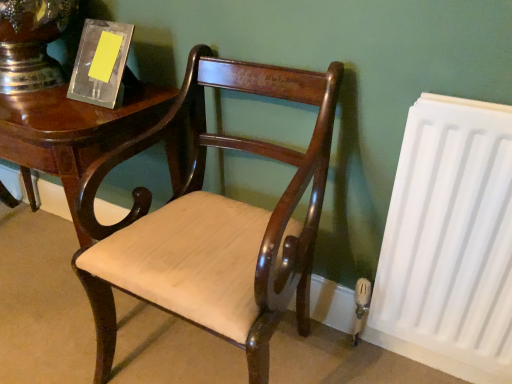
Question: Is white matte radiator at right completely or partially inside shiny dark wood table at left?

Choices:
 (A) yes
 (B) no

Answer: (B)

Question: Considering the relative sizes of shiny dark wood table at left and white matte radiator at right in the image provided, is shiny dark wood table at left bigger than white matte radiator at right?

Choices:
 (A) no
 (B) yes

Answer: (B)

Question: From a real-world perspective, is shiny dark wood table at left below white matte radiator at right?

Choices:
 (A) yes
 (B) no

Answer: (A)

Question: Is shiny dark wood table at left facing away from white matte radiator at right?

Choices:
 (A) yes
 (B) no

Answer: (B)

Question: Considering the relative sizes of shiny dark wood table at left and white matte radiator at right in the image provided, is shiny dark wood table at left smaller than white matte radiator at right?

Choices:
 (A) no
 (B) yes

Answer: (A)

Question: From the image's perspective, is shiny dark wood table at left positioned above or below white matte radiator at right?

Choices:
 (A) above
 (B) below

Answer: (A)

Question: Does point (17, 122) appear closer or farther from the camera than point (400, 309)?

Choices:
 (A) closer
 (B) farther

Answer: (A)

Question: In terms of size, does shiny dark wood table at left appear bigger or smaller than white matte radiator at right?

Choices:
 (A) big
 (B) small

Answer: (A)

Question: Choose the correct answer: Is shiny dark wood table at left inside white matte radiator at right or outside it?

Choices:
 (A) inside
 (B) outside

Answer: (B)

Question: In terms of width, does mahogany wood chair at center look wider or thinner when compared to white matte radiator at right?

Choices:
 (A) wide
 (B) thin

Answer: (A)

Question: From a real-world perspective, relative to white matte radiator at right, is mahogany wood chair at center vertically above or below?

Choices:
 (A) below
 (B) above

Answer: (B)

Question: From the image's perspective, is mahogany wood chair at center above or below white matte radiator at right?

Choices:
 (A) below
 (B) above

Answer: (B)

Question: Would you say mahogany wood chair at center is to the left or to the right of white matte radiator at right in the picture?

Choices:
 (A) left
 (B) right

Answer: (A)

Question: From the image's perspective, relative to shiny dark wood table at left, is white matte radiator at right above or below?

Choices:
 (A) above
 (B) below

Answer: (B)

Question: From a real-world perspective, is white matte radiator at right above or below shiny dark wood table at left?

Choices:
 (A) above
 (B) below

Answer: (A)